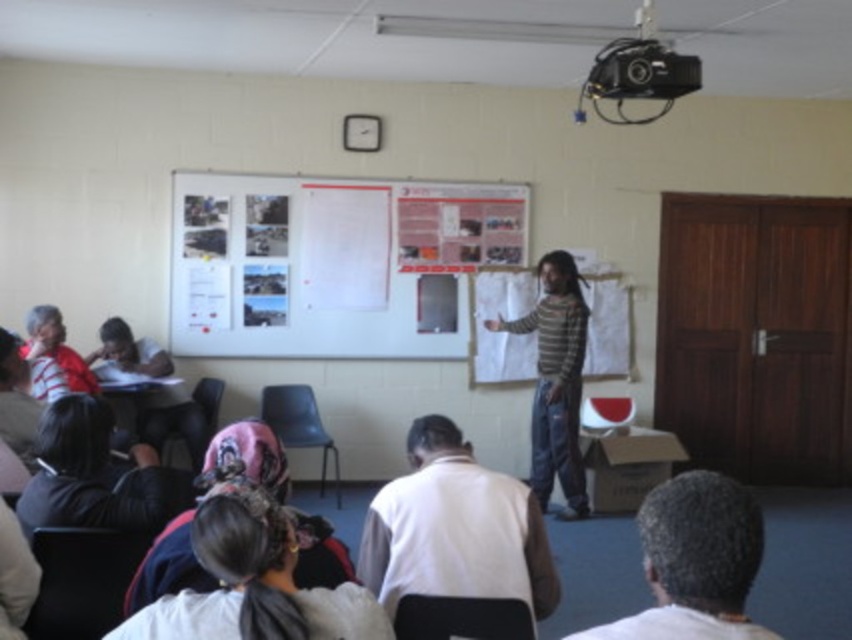
Consider the image. Who is more forward, (90, 564) or (626, 90)?

Positioned in front is point (90, 564).

Looking at this image, does matte black chair at lower left have a lesser height compared to black plastic projector at upper center?

Correct, matte black chair at lower left is not as tall as black plastic projector at upper center.

Locate an element on the screen. matte black chair at lower left is located at coordinates (82, 580).

Locate an element on the screen. The image size is (852, 640). matte black chair at lower left is located at coordinates (82, 580).

Is whiteboard at upper center wider than black fabric chair at lower center?

Yes.

Looking at this image, can you confirm if whiteboard at upper center is positioned to the right of black fabric chair at lower center?

No, whiteboard at upper center is not to the right of black fabric chair at lower center.

Between point (239, 285) and point (422, 609), which one is positioned behind?

The point (239, 285) is more distant.

Find the location of a particular element. whiteboard at upper center is located at coordinates (332, 262).

Can you confirm if dark brown hair at lower left is shorter than velvet pink chair at lower left?

Indeed, dark brown hair at lower left has a lesser height compared to velvet pink chair at lower left.

Which is behind, point (164, 516) or point (196, 390)?

The point (196, 390) is behind.

The width and height of the screenshot is (852, 640). I want to click on dark brown hair at lower left, so click(x=95, y=476).